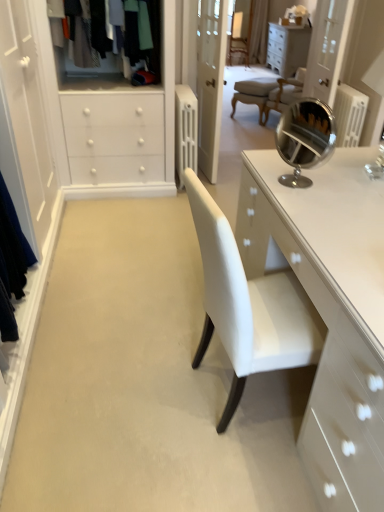
The width and height of the screenshot is (384, 512). I want to click on polished chrome mirror at upper right, so click(304, 138).

You are a GUI agent. You are given a task and a screenshot of the screen. Output one action in this format:
    pyautogui.click(x=<x>, y=<y>)
    Task: Click on the textured wool sweater at upper left
    
    Given the screenshot: What is the action you would take?
    pyautogui.click(x=142, y=34)

Relative to polished chrome mirror at upper right, is white glossy cabinet at upper center in front or behind?

white glossy cabinet at upper center is positioned farther from the viewer than polished chrome mirror at upper right.

What's the angular difference between white glossy cabinet at upper center and polished chrome mirror at upper right's facing directions?

36.1 degrees separate the facing orientations of white glossy cabinet at upper center and polished chrome mirror at upper right.

In the image, is white glossy cabinet at upper center on the left side or the right side of polished chrome mirror at upper right?

white glossy cabinet at upper center is to the right of polished chrome mirror at upper right.

Is white glossy cabinet at upper center spatially inside polished chrome mirror at upper right, or outside of it?

white glossy cabinet at upper center cannot be found inside polished chrome mirror at upper right.

Can you confirm if transparent glass door at upper right is positioned to the right of white glossy cabinet at upper center?

In fact, transparent glass door at upper right is to the left of white glossy cabinet at upper center.

From the image's perspective, is transparent glass door at upper right on top of white glossy cabinet at upper center?

No, from the image's perspective, transparent glass door at upper right is not on top of white glossy cabinet at upper center.

Considering the relative sizes of transparent glass door at upper right and white glossy cabinet at upper center in the image provided, is transparent glass door at upper right thinner than white glossy cabinet at upper center?

Yes, transparent glass door at upper right is thinner than white glossy cabinet at upper center.

Is transparent glass door at upper right outside of white glossy cabinet at upper center?

Absolutely, transparent glass door at upper right is external to white glossy cabinet at upper center.

From the image's perspective, is textured wool sweater at upper left positioned above or below transparent glass door at upper right?

Clearly, from the image's perspective, textured wool sweater at upper left is below transparent glass door at upper right.

From a real-world perspective, which object stands above the other?

From a 3D spatial view, textured wool sweater at upper left is above.

Which of these two, textured wool sweater at upper left or transparent glass door at upper right, is thinner?

With smaller width is transparent glass door at upper right.

How much distance is there between textured wool sweater at upper left and transparent glass door at upper right?

The distance of textured wool sweater at upper left from transparent glass door at upper right is 7.03 feet.

In the image, there is a polished chrome mirror at upper right. What are the coordinates of `glass door above it (from the image's perspective)` in the screenshot? It's located at (327, 49).

Considering the sizes of objects transparent glass door at upper right and polished chrome mirror at upper right in the image provided, who is smaller, transparent glass door at upper right or polished chrome mirror at upper right?

polished chrome mirror at upper right.

How different are the orientations of transparent glass door at upper right and polished chrome mirror at upper right in degrees?

38.8 degrees.

From the image's perspective, which is above, transparent glass door at upper right or polished chrome mirror at upper right?

transparent glass door at upper right appears higher in the image.

Which is closer to the camera, (307, 28) or (145, 30)?

The point (145, 30) is closer.

Could you tell me if white glossy cabinet at upper center is facing textured wool sweater at upper left?

No, white glossy cabinet at upper center is not turned towards textured wool sweater at upper left.

Is the depth of white glossy cabinet at upper center less than that of textured wool sweater at upper left?

No, it is not.

From a real-world perspective, which is physically above, white glossy cabinet at upper center or textured wool sweater at upper left?

textured wool sweater at upper left.

From the picture: From the image's perspective, would you say polished chrome mirror at upper right is shown under white glossy cabinet at upper center?

Indeed, from the image's perspective, polished chrome mirror at upper right is shown beneath white glossy cabinet at upper center.

Is polished chrome mirror at upper right taller than white glossy cabinet at upper center?

No, polished chrome mirror at upper right is not taller than white glossy cabinet at upper center.

How much distance is there between polished chrome mirror at upper right and white glossy cabinet at upper center?

A distance of 2.71 meters exists between polished chrome mirror at upper right and white glossy cabinet at upper center.

From a real-world perspective, is polished chrome mirror at upper right beneath white glossy cabinet at upper center?

Incorrect, from a real-world perspective, polished chrome mirror at upper right is higher than white glossy cabinet at upper center.

Is polished chrome mirror at upper right touching textured wool sweater at upper left?

polished chrome mirror at upper right is not next to textured wool sweater at upper left, and they're not touching.

Between polished chrome mirror at upper right and textured wool sweater at upper left, which one has larger width?

textured wool sweater at upper left is wider.

Where is `mirror below the textured wool sweater at upper left (from a real-world perspective)`? mirror below the textured wool sweater at upper left (from a real-world perspective) is located at coordinates (304, 138).

At what (x,y) coordinates should I click in order to perform the action: click on mirror located in front of the white glossy cabinet at upper center. Please return your answer as a coordinate pair (x, y). Looking at the image, I should click on (304, 138).

This screenshot has width=384, height=512. I want to click on cabinetry beneath the transparent glass door at upper right (from a real-world perspective), so click(x=287, y=48).

Based on their spatial positions, is white glossy cabinet at upper center or polished chrome mirror at upper right closer to transparent glass door at upper right?

white glossy cabinet at upper center lies closer to transparent glass door at upper right than the other object.

Considering their positions, is polished chrome mirror at upper right positioned closer to textured wool sweater at upper left than white glossy cabinet at upper center?

polished chrome mirror at upper right is positioned closer to the anchor textured wool sweater at upper left.

Based on their spatial positions, is polished chrome mirror at upper right or textured wool sweater at upper left further from transparent glass door at upper right?

textured wool sweater at upper left lies further to transparent glass door at upper right than the other object.

In the scene shown: When comparing their distances from polished chrome mirror at upper right, does white glossy cabinet at upper center or textured wool sweater at upper left seem closer?

The object closer to polished chrome mirror at upper right is textured wool sweater at upper left.

Which object lies nearer to the anchor point transparent glass door at upper right, white glossy cabinet at upper center or textured wool sweater at upper left?

white glossy cabinet at upper center is positioned closer to the anchor transparent glass door at upper right.

Based on their spatial positions, is transparent glass door at upper right or polished chrome mirror at upper right closer to textured wool sweater at upper left?

Based on the image, polished chrome mirror at upper right appears to be nearer to textured wool sweater at upper left.

Which object lies nearer to the anchor point textured wool sweater at upper left, transparent glass door at upper right or white glossy cabinet at upper center?

Based on the image, transparent glass door at upper right appears to be nearer to textured wool sweater at upper left.

When comparing their distances from textured wool sweater at upper left, does white glossy cabinet at upper center or transparent glass door at upper right seem further?

white glossy cabinet at upper center.

Locate an element on the screen. clothing located between polished chrome mirror at upper right and white glossy cabinet at upper center in the depth direction is located at coordinates (142, 34).

Find the location of a particular element. glass door between textured wool sweater at upper left and white glossy cabinet at upper center from front to back is located at coordinates (327, 49).

What are the coordinates of `mirror between textured wool sweater at upper left and transparent glass door at upper right in the horizontal direction` in the screenshot? It's located at (304, 138).

Where is `glass door between polished chrome mirror at upper right and white glossy cabinet at upper center from front to back`? glass door between polished chrome mirror at upper right and white glossy cabinet at upper center from front to back is located at coordinates (327, 49).